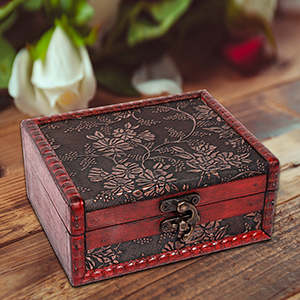
I want to click on darker wood, so click(276, 125).